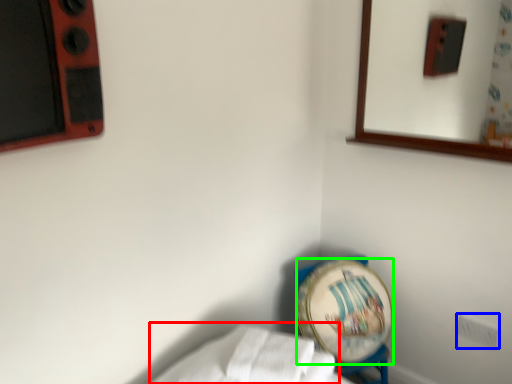
Question: Based on their relative distances, which object is nearer to sheet (highlighted by a red box)? Choose from electric outlet (highlighted by a blue box) and platter (highlighted by a green box).

Choices:
 (A) electric outlet
 (B) platter

Answer: (B)